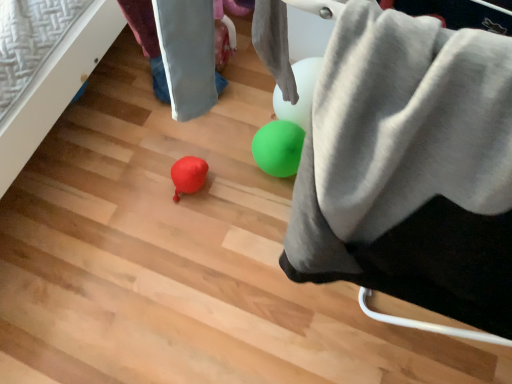
You are a GUI agent. You are given a task and a screenshot of the screen. Output one action in this format:
    pyautogui.click(x=<x>, y=<y>)
    Task: Click on the vacant space in velvet gray bean bag chair at center (from a real-world perspective)
    Image resolution: width=512 pixels, height=384 pixels.
    Given the screenshot: What is the action you would take?
    pyautogui.click(x=369, y=331)